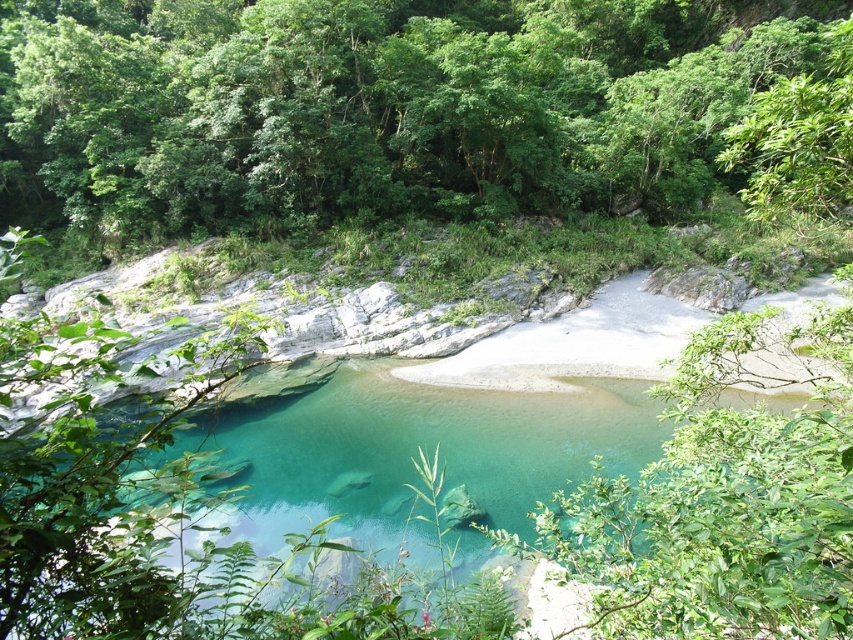
You are planning to set up a small boat in the clear glassy water at center. Considering the green leafy trees at upper center, are there any potential obstacles you should be aware of?

The green leafy trees at upper center are positioned over the clear glassy water at center, so their branches or falling leaves might obstruct the boat or create debris in the water.